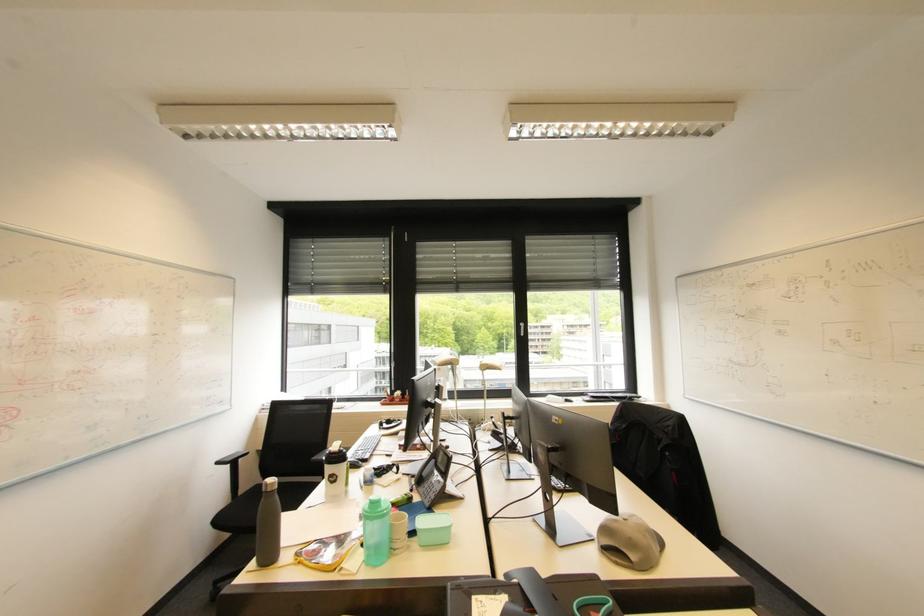
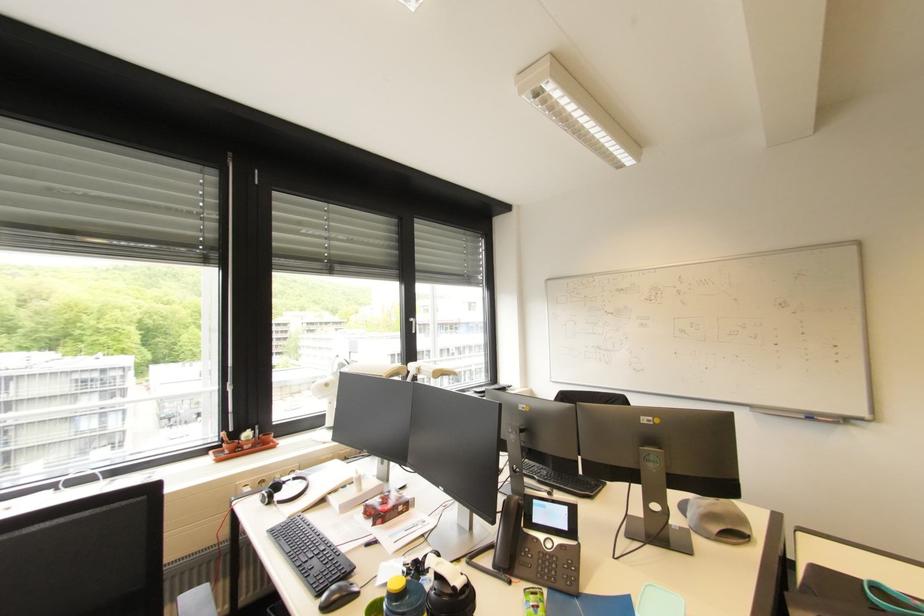
In the second image, find the point that corresponds to point (453, 459) in the first image.

(572, 509)